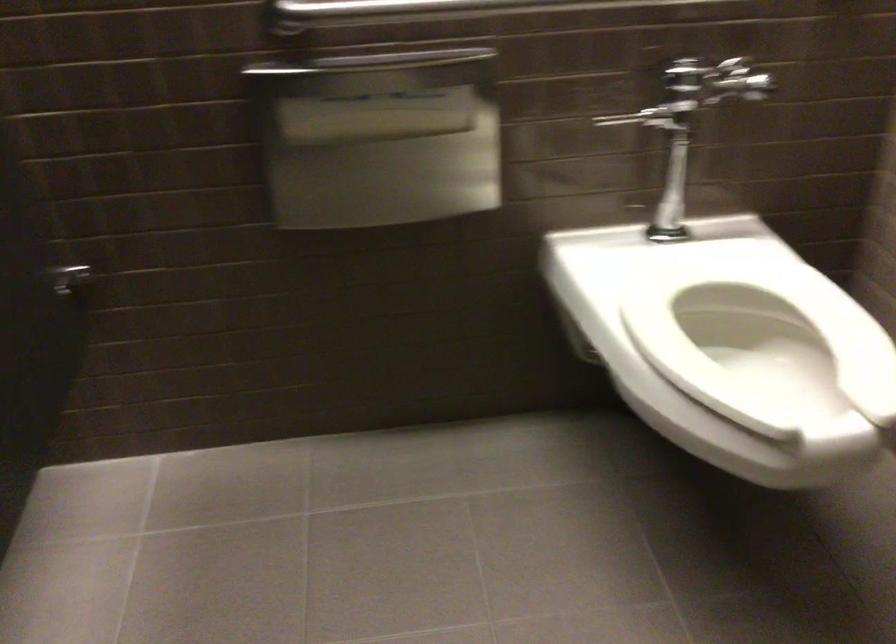
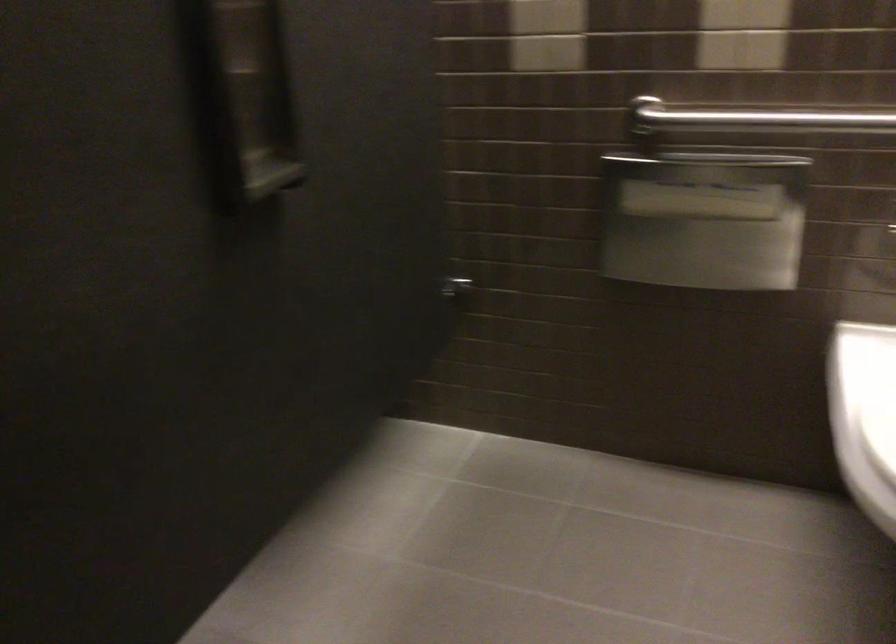
Question: The images are taken continuously from a first-person perspective. In which direction is your viewpoint rotating?

Choices:
 (A) Left
 (B) Right
 (C) Up
 (D) Down

Answer: (A)